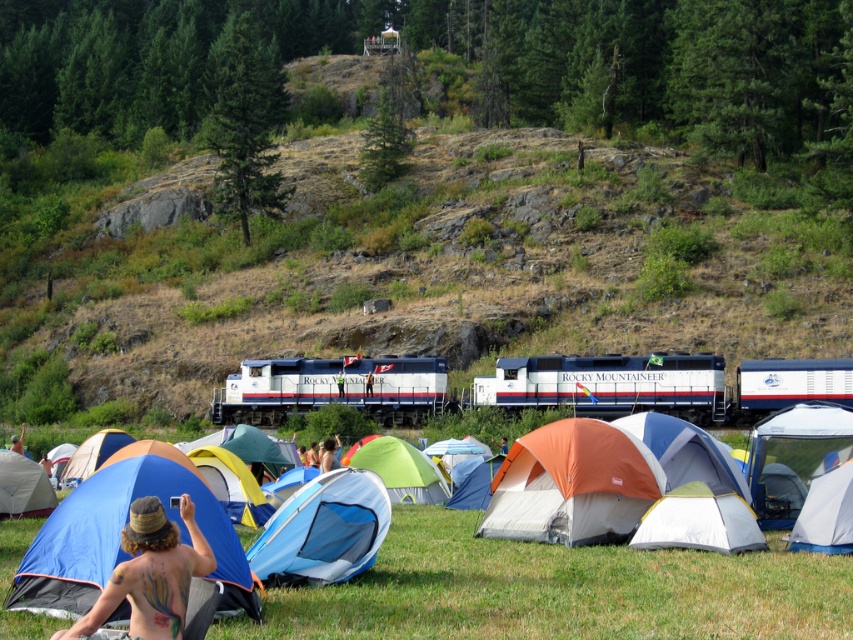
Can you confirm if orange nylon tent at center is bigger than white canvas tent at center?

Yes, orange nylon tent at center is bigger than white canvas tent at center.

Which is below, orange nylon tent at center or white canvas tent at center?

white canvas tent at center is lower down.

Does point (581, 506) lie behind point (828, 531)?

Yes, it is behind point (828, 531).

You are a GUI agent. You are given a task and a screenshot of the screen. Output one action in this format:
    pyautogui.click(x=<x>, y=<y>)
    Task: Click on the orange nylon tent at center
    This screenshot has height=640, width=853.
    Given the screenshot: What is the action you would take?
    [x=572, y=484]

Based on the photo, is the position of white nylon tent at center more distant than that of green fabric tent at center?

That is False.

Is white nylon tent at center bigger than green fabric tent at center?

Incorrect, white nylon tent at center is not larger than green fabric tent at center.

Does point (747, 541) come farther from viewer compared to point (418, 464)?

No, (747, 541) is closer to viewer.

You are a GUI agent. You are given a task and a screenshot of the screen. Output one action in this format:
    pyautogui.click(x=<x>, y=<y>)
    Task: Click on the white nylon tent at center
    The height and width of the screenshot is (640, 853).
    Given the screenshot: What is the action you would take?
    pyautogui.click(x=699, y=522)

Who is positioned more to the right, multicolored fabric tents at center or shiny metallic camera at center?

multicolored fabric tents at center

In the scene shown: Who is higher up, multicolored fabric tents at center or shiny metallic camera at center?

shiny metallic camera at center

Which is in front, point (254, 632) or point (91, 616)?

Positioned in front is point (91, 616).

Where is `multicolored fabric tents at center`? The height and width of the screenshot is (640, 853). multicolored fabric tents at center is located at coordinates (558, 589).